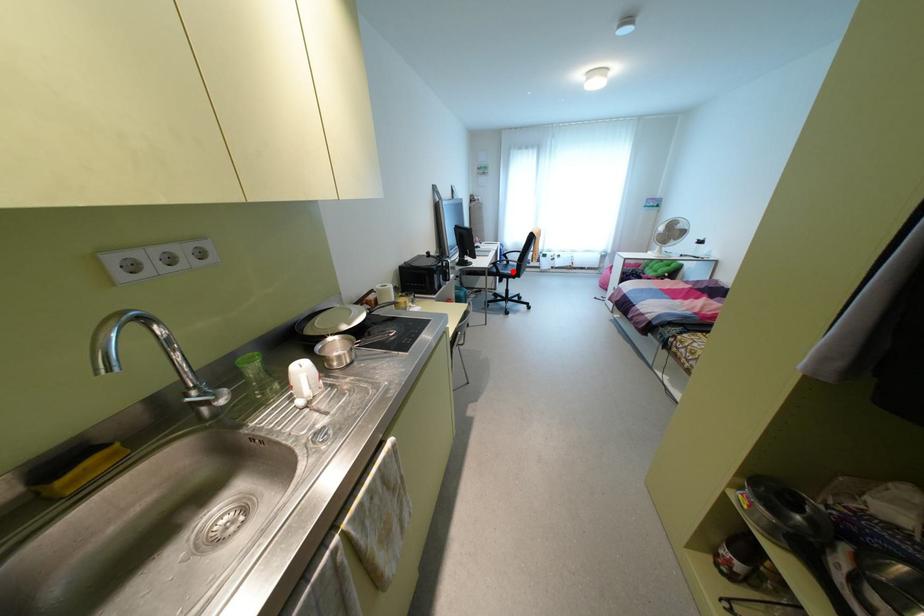
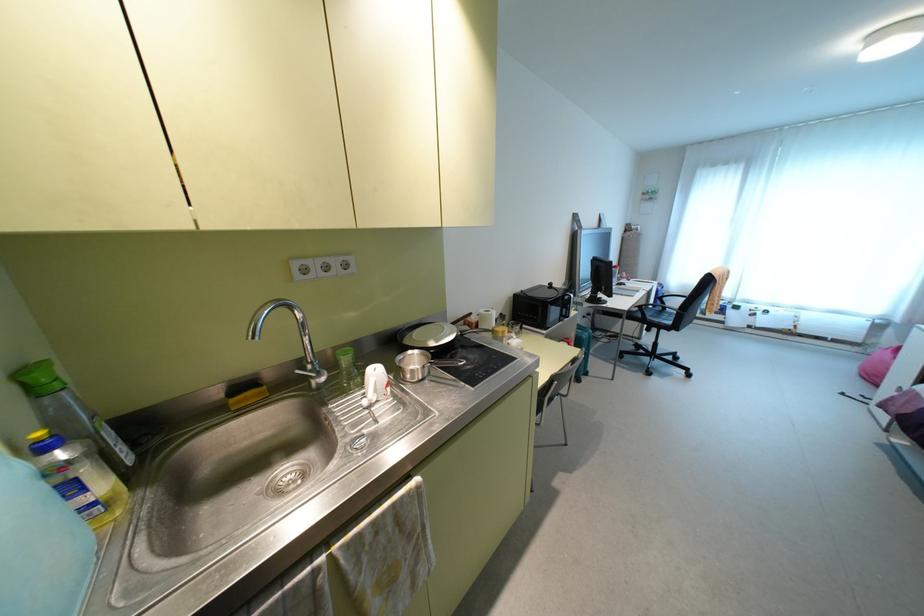
Find the pixel in the second image that matches the highlighted location in the first image.

(667, 322)